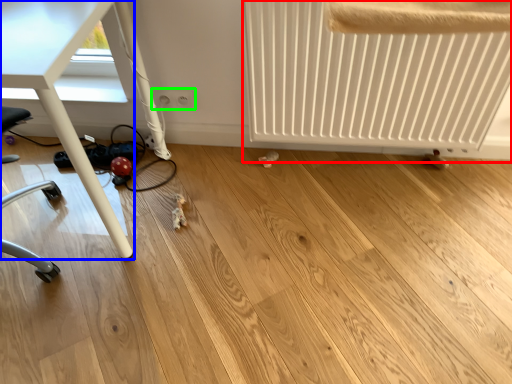
Question: Considering the real-world distances, which object is closest to radiator (highlighted by a red box)? table (highlighted by a blue box) or electric outlet (highlighted by a green box).

Choices:
 (A) table
 (B) electric outlet

Answer: (B)